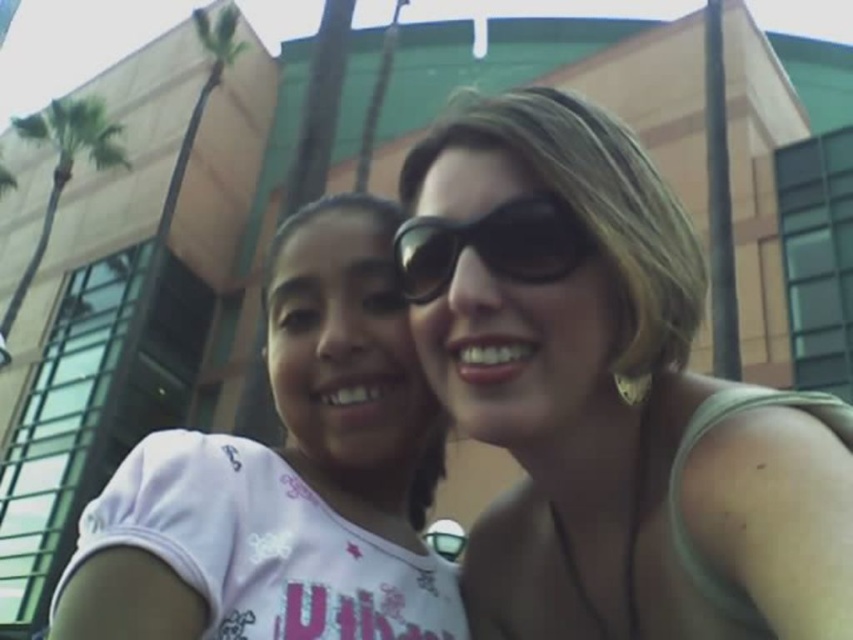
Question: Which point appears closest to the camera in this image?

Choices:
 (A) (4, 333)
 (B) (334, 243)
 (C) (431, 227)

Answer: (C)

Question: Can you confirm if white glossy shirt at center is positioned to the right of green leafy palm tree at upper left?

Choices:
 (A) yes
 (B) no

Answer: (A)

Question: Can you confirm if white glossy shirt at center is thinner than black reflective sunglasses at center?

Choices:
 (A) no
 (B) yes

Answer: (A)

Question: Which point appears farthest from the camera in this image?

Choices:
 (A) (302, 506)
 (B) (688, 266)
 (C) (55, 204)

Answer: (C)

Question: Does matte black sunglasses at upper center have a lesser width compared to white glossy shirt at center?

Choices:
 (A) yes
 (B) no

Answer: (A)

Question: Considering the real-world distances, which object is farthest from the green leafy palm tree at upper left?

Choices:
 (A) white glossy shirt at center
 (B) black reflective sunglasses at center
 (C) matte black sunglasses at upper center

Answer: (B)